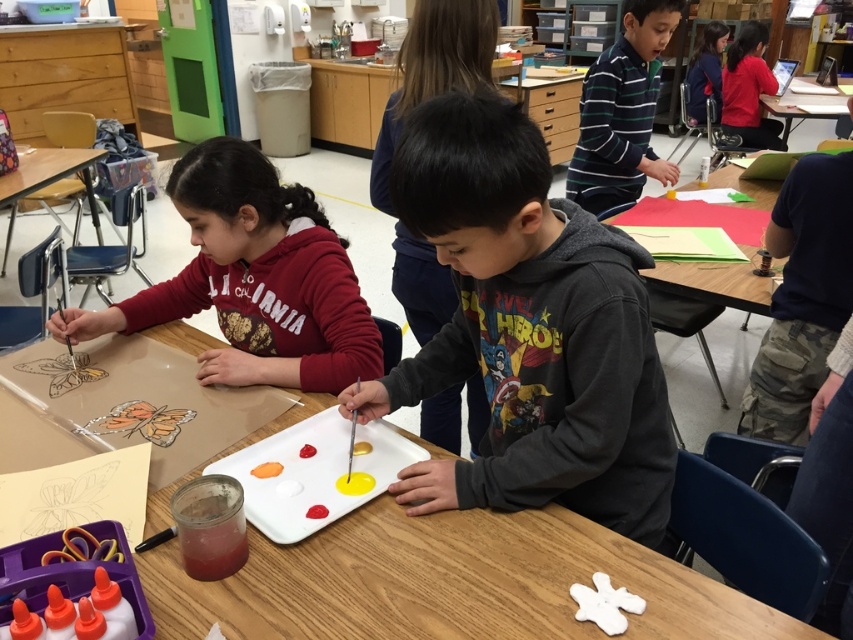
Can you confirm if matte red hoodie at upper left is smaller than matte red hoodie at upper center?

Yes.

Who is positioned more to the right, matte red hoodie at upper left or matte red hoodie at upper center?

Positioned to the right is matte red hoodie at upper center.

Who is more distant from viewer, (239, 157) or (761, 51)?

Positioned behind is point (761, 51).

Identify the location of matte red hoodie at upper left. Image resolution: width=853 pixels, height=640 pixels. (253, 280).

Is dark gray hoodie at center below dark blue hoodie at upper right?

Indeed, dark gray hoodie at center is positioned under dark blue hoodie at upper right.

Locate an element on the screen. The height and width of the screenshot is (640, 853). dark gray hoodie at center is located at coordinates (434, 70).

Is gray fleece hoodie at center taller than yellow matte paint brush at center?

Indeed, gray fleece hoodie at center has a greater height compared to yellow matte paint brush at center.

Does gray fleece hoodie at center have a lesser height compared to yellow matte paint brush at center?

In fact, gray fleece hoodie at center may be taller than yellow matte paint brush at center.

Who is more forward, (x=438, y=371) or (x=349, y=436)?

Positioned in front is point (x=349, y=436).

The width and height of the screenshot is (853, 640). I want to click on gray fleece hoodie at center, so click(x=527, y=330).